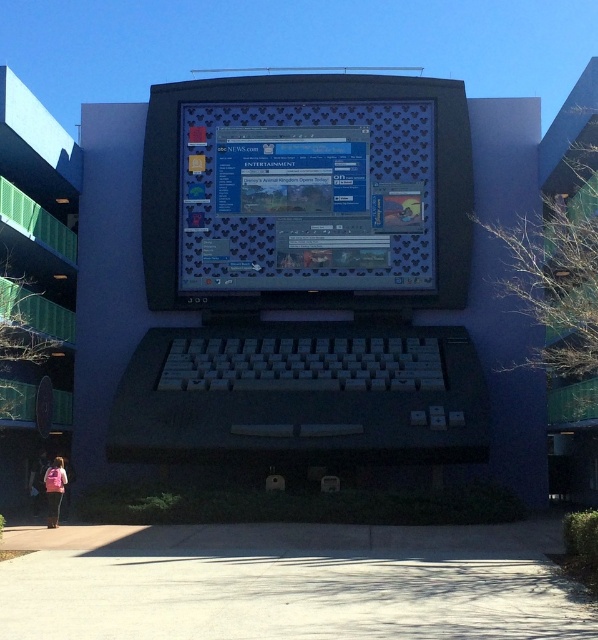
You are standing in front of the large artistic computer display. Where is the shiny plastic screen at center located in terms of its 2D coordinates?

The shiny plastic screen at center is located at the 2D coordinates point (306,196).

You are a maintenance worker needing to inspect both the gray concrete pavement at lower center and the shiny plastic screen at center. Which object should you check first if you start from the left side of the scene?

The gray concrete pavement at lower center should be checked first since it is positioned on the left side of the shiny plastic screen at center, meaning it is closer to your starting position.